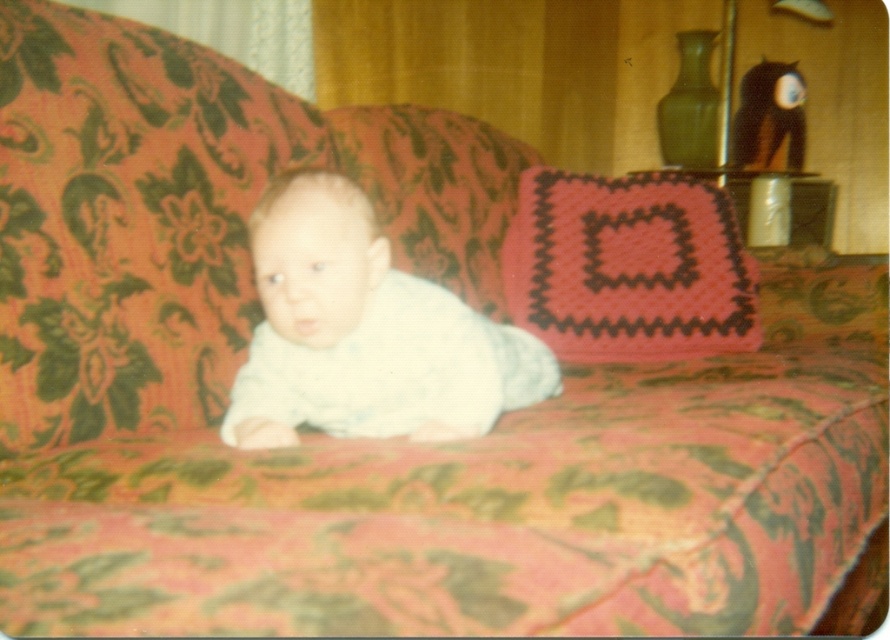
Question: Observing the image, what is the correct spatial positioning of white soft fabric baby at center in reference to knitted pink pillow at center?

Choices:
 (A) above
 (B) below

Answer: (B)

Question: Can you confirm if white soft fabric baby at center is positioned to the right of knitted pink pillow at center?

Choices:
 (A) yes
 (B) no

Answer: (B)

Question: Which object is closer to the camera taking this photo?

Choices:
 (A) white soft fabric baby at center
 (B) knitted pink pillow at center

Answer: (A)

Question: Is white soft fabric baby at center to the left of knitted pink pillow at center from the viewer's perspective?

Choices:
 (A) no
 (B) yes

Answer: (B)